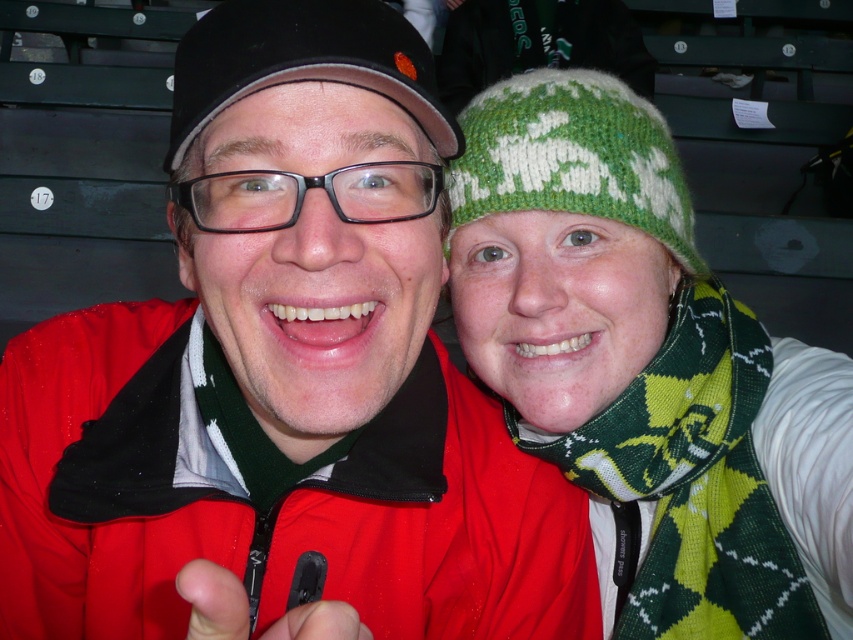
Question: Is green knitted scarf at right to the right of black matte cap at upper center from the viewer's perspective?

Choices:
 (A) no
 (B) yes

Answer: (B)

Question: Is matte black jacket at center further to the viewer compared to black matte cap at upper center?

Choices:
 (A) no
 (B) yes

Answer: (A)

Question: Estimate the real-world distances between objects in this image. Which object is farther from the black matte cap at upper center?

Choices:
 (A) green knitted scarf at right
 (B) green knitted hat at upper right
 (C) matte black jacket at center

Answer: (A)

Question: Which point is closer to the camera taking this photo?

Choices:
 (A) (258, 1)
 (B) (294, 186)
 (C) (654, 524)
 (D) (459, 116)

Answer: (B)

Question: Can you confirm if matte black jacket at center is wider than green knitted hat at upper right?

Choices:
 (A) no
 (B) yes

Answer: (B)

Question: Among these points, which one is farthest from the camera?

Choices:
 (A) (267, 35)
 (B) (527, 138)
 (C) (96, 346)
 (D) (641, 461)

Answer: (D)